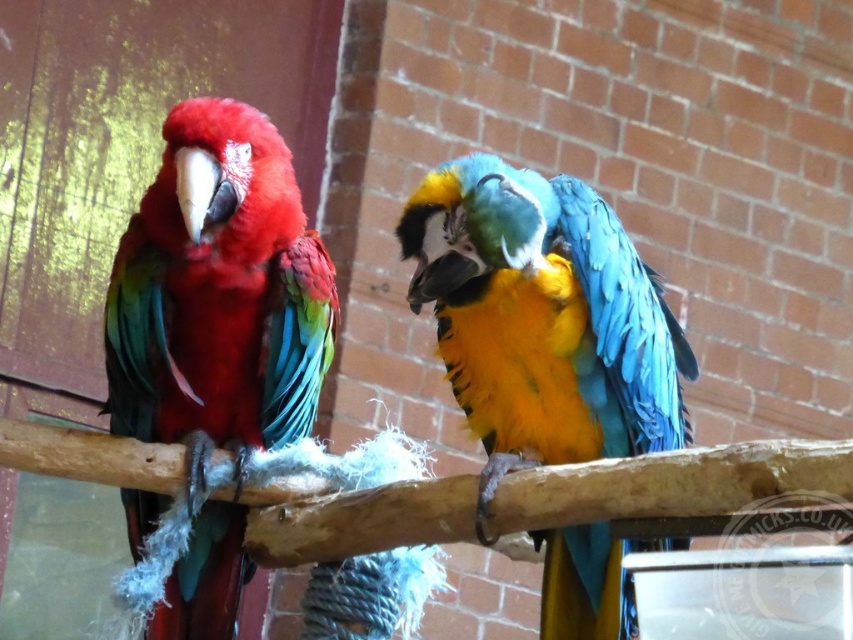
Is blue-green feathers parrot at center wider than matte green parrot at center?

Correct, the width of blue-green feathers parrot at center exceeds that of matte green parrot at center.

Describe the element at coordinates (543, 317) in the screenshot. I see `blue-green feathers parrot at center` at that location.

This screenshot has height=640, width=853. I want to click on blue-green feathers parrot at center, so 543,317.

Who is positioned more to the right, blue-green feathers parrot at center or wooden branch at center?

Positioned to the right is blue-green feathers parrot at center.

Does blue-green feathers parrot at center appear on the right side of wooden branch at center?

Correct, you'll find blue-green feathers parrot at center to the right of wooden branch at center.

At what (x,y) coordinates should I click in order to perform the action: click on blue-green feathers parrot at center. Please return your answer as a coordinate pair (x, y). The height and width of the screenshot is (640, 853). Looking at the image, I should click on (543, 317).

Is matte green parrot at center wider than wooden branch at center?

No, matte green parrot at center is not wider than wooden branch at center.

Locate an element on the screen. This screenshot has width=853, height=640. matte green parrot at center is located at coordinates (216, 332).